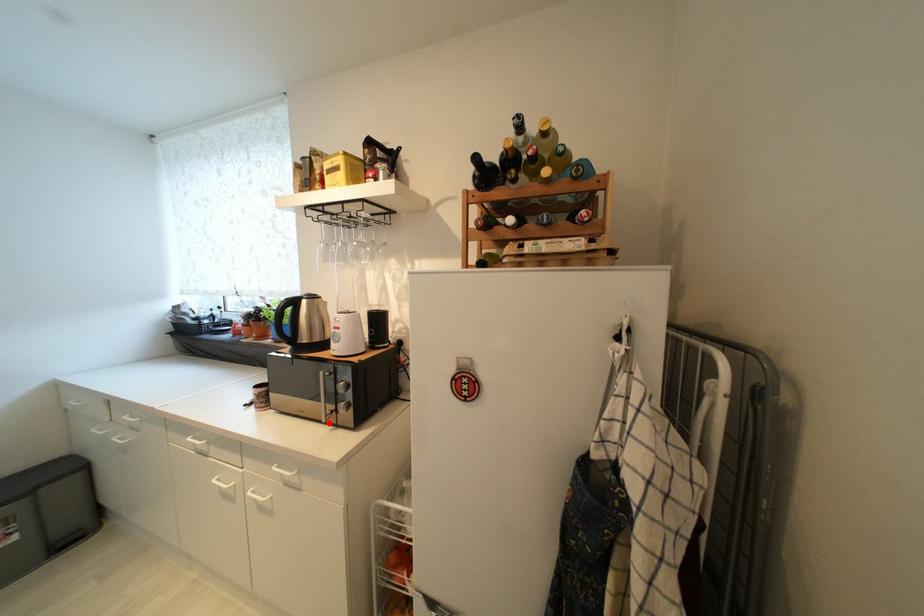
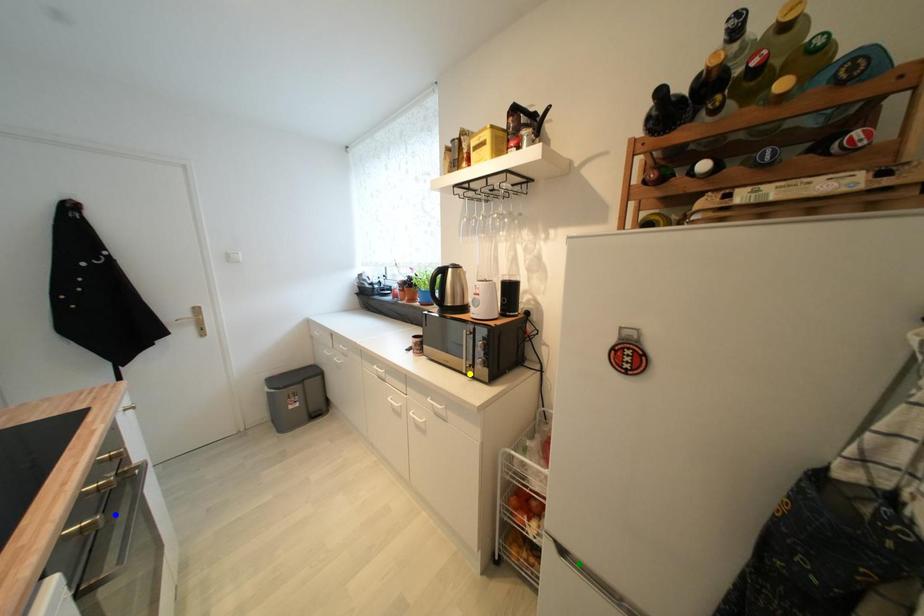
Question: I am providing you with two images of the same scene from different viewpoints. A red point is marked on the first image. You are given multiple points on the second image. Which point in image 2 represents the same 3d spot as the red point in image 1?

Choices:
 (A) green point
 (B) blue point
 (C) yellow point

Answer: (C)